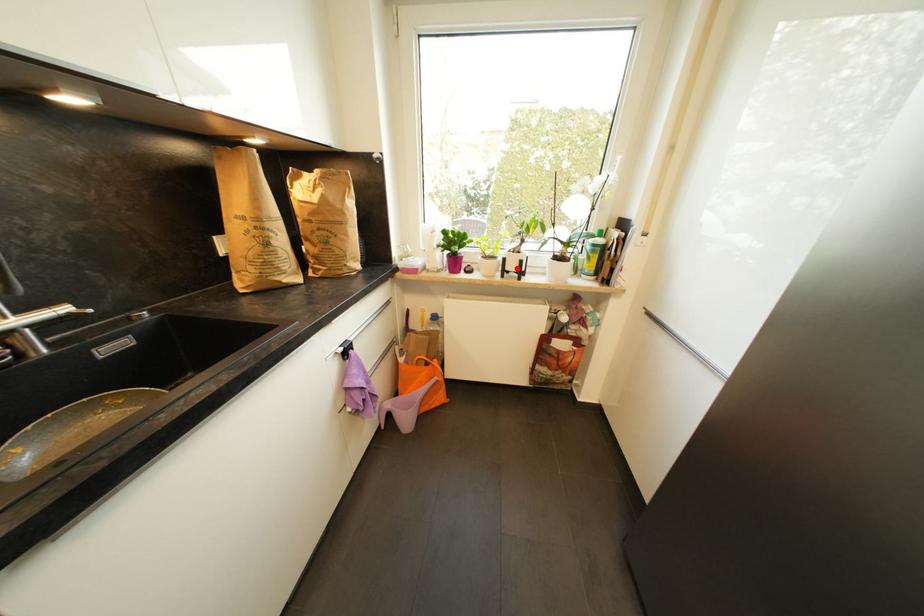
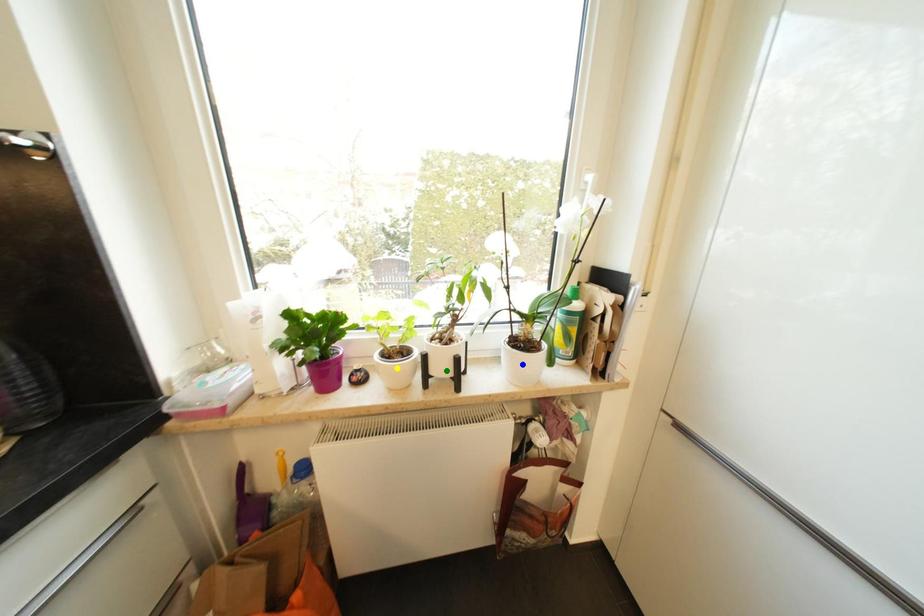
Question: I am providing you with two images of the same scene from different viewpoints. A red point is marked on the first image. You are given multiple points on the second image. Can you choose the point in image 2 that corresponds to the point in image 1?

Choices:
 (A) green point
 (B) yellow point
 (C) blue point

Answer: (A)